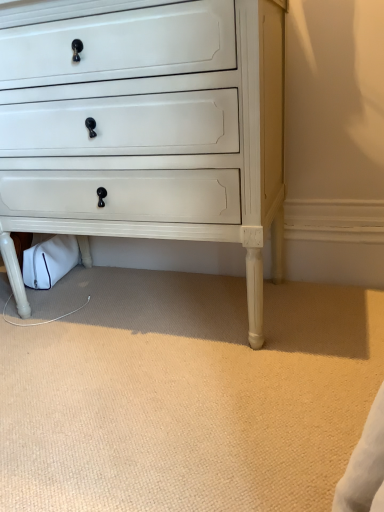
What do you see at coordinates (146, 127) in the screenshot? I see `white painted wood chest of drawers at center` at bounding box center [146, 127].

Where is `white painted wood chest of drawers at center`? The width and height of the screenshot is (384, 512). white painted wood chest of drawers at center is located at coordinates (146, 127).

The height and width of the screenshot is (512, 384). I want to click on white painted wood chest of drawers at center, so click(x=146, y=127).